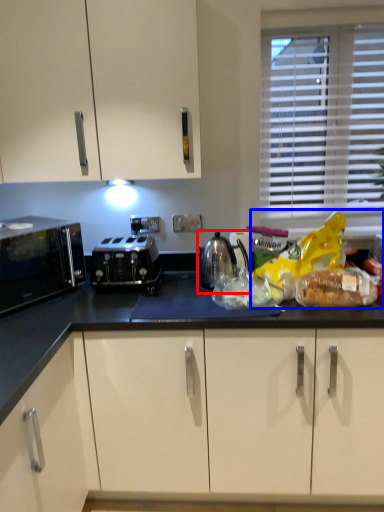
Question: Among these objects, which one is nearest to the camera, kitchen appliance (highlighted by a red box) or food (highlighted by a blue box)?

Choices:
 (A) kitchen appliance
 (B) food

Answer: (B)